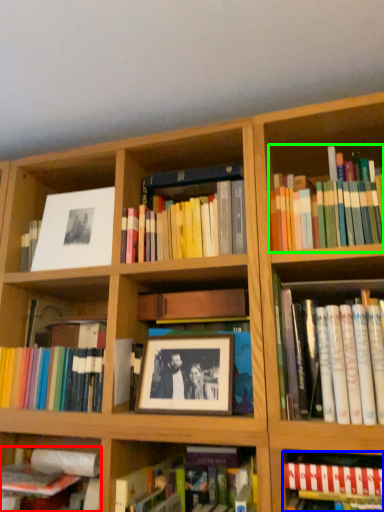
Question: Which is farther away from book (highlighted by a red box)? book (highlighted by a blue box) or book (highlighted by a green box)?

Choices:
 (A) book
 (B) book

Answer: (B)